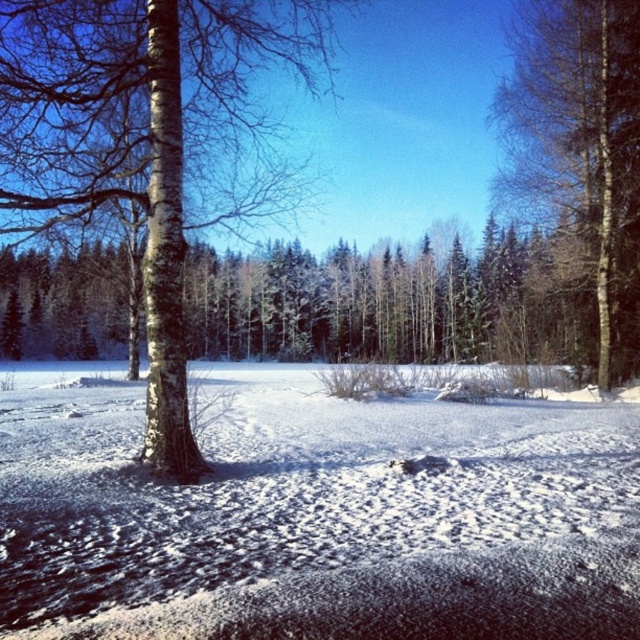
Question: Among these points, which one is farthest from the camera?

Choices:
 (A) (544, 115)
 (B) (392, 621)

Answer: (A)

Question: Is white fluffy snow at center closer to camera compared to white bark tree at left?

Choices:
 (A) yes
 (B) no

Answer: (A)

Question: Among these objects, which one is farthest from the camera?

Choices:
 (A) bark-like textured tree at right
 (B) white bark tree at left
 (C) white fluffy snow at center

Answer: (A)

Question: Does white fluffy snow at center have a lesser width compared to white bark tree at left?

Choices:
 (A) no
 (B) yes

Answer: (A)

Question: Does white bark tree at left come in front of bark-like textured tree at right?

Choices:
 (A) yes
 (B) no

Answer: (A)

Question: Which of the following is the farthest from the observer?

Choices:
 (A) (44, 556)
 (B) (529, 109)
 (C) (230, 77)

Answer: (B)